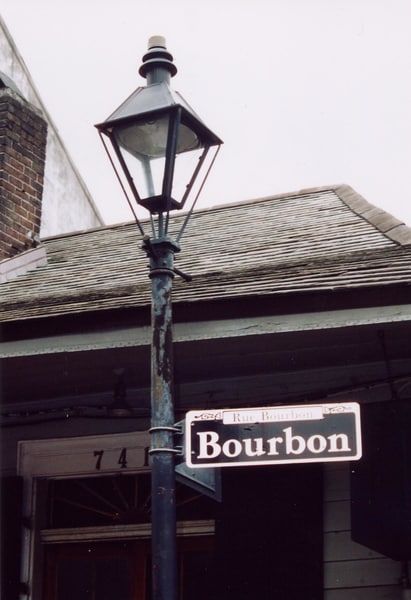
Where is `light`? The width and height of the screenshot is (411, 600). light is located at coordinates (163, 134).